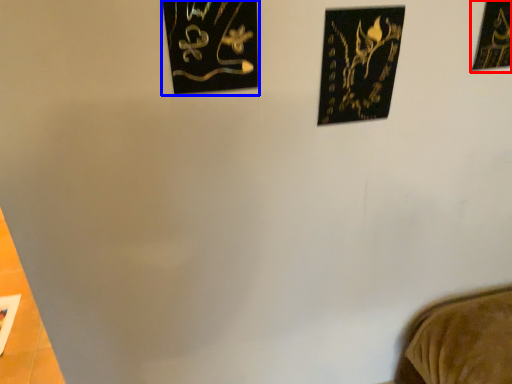
Question: Which object appears farthest to the camera in this image, picture frame (highlighted by a red box) or picture frame (highlighted by a blue box)?

Choices:
 (A) picture frame
 (B) picture frame

Answer: (A)